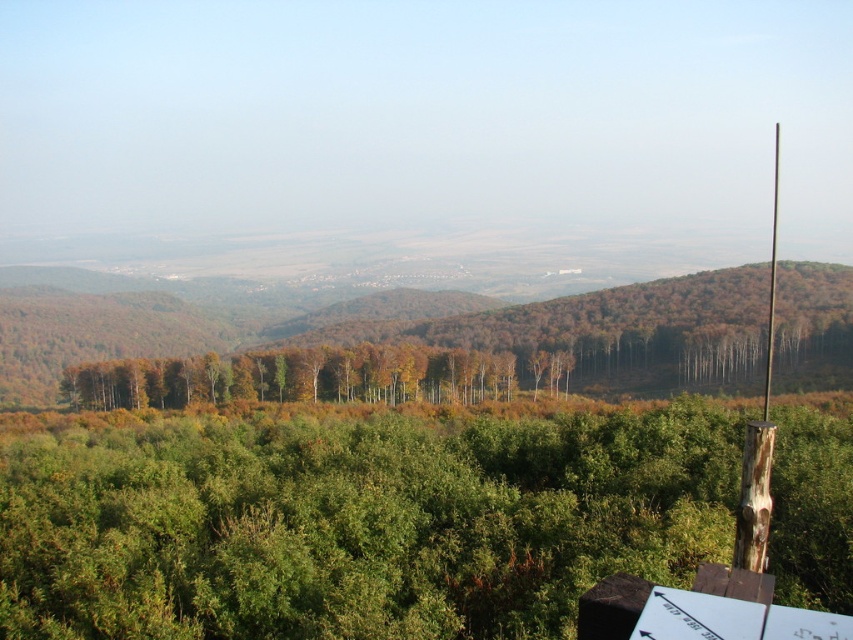
You are standing at the viewpoint looking at the landscape. There are two points marked in the image, one at coordinates point (230, 524) and the other at point (772, 202). Which point is nearer to you?

Point (230, 524) is closer to the viewer than point (772, 202).

Consider the image. You are standing at the wooden post at right and want to walk towards the green leafy forest at center. In which direction should you move?

You should move to the left because the green leafy forest at center is to the left of the wooden post at right.

You are a hiker trying to reach the green leafy forest at center. From your current position near the wooden post at right, which direction should you move to get there?

The green leafy forest at center is positioned under the wooden post at right, so you should move downward from the wooden post at right to reach the green leafy forest at center.